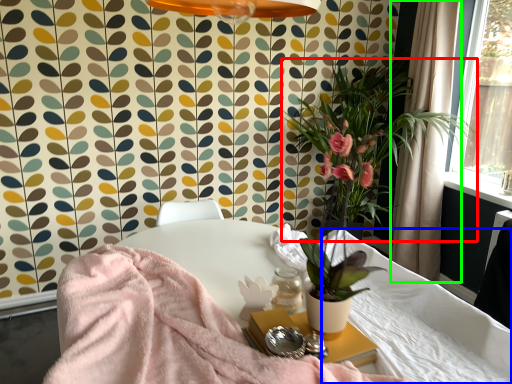
Question: Considering the real-world distances, which object is farthest from houseplant (highlighted by a red box)? mattress (highlighted by a blue box) or curtain (highlighted by a green box)?

Choices:
 (A) mattress
 (B) curtain

Answer: (A)